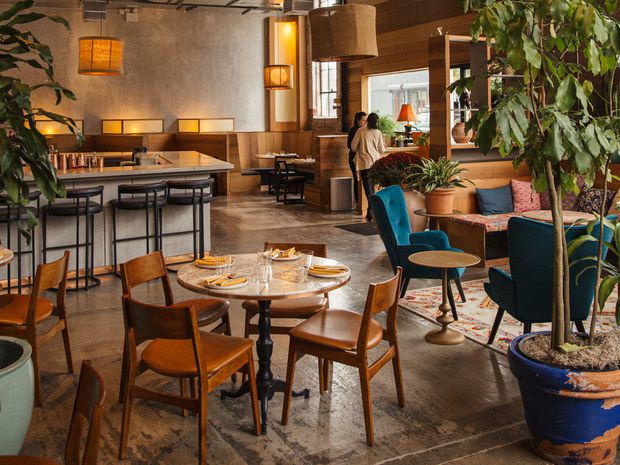
Where is `pillows`? pillows is located at coordinates (492, 201), (514, 196), (567, 196), (588, 201), (612, 209).